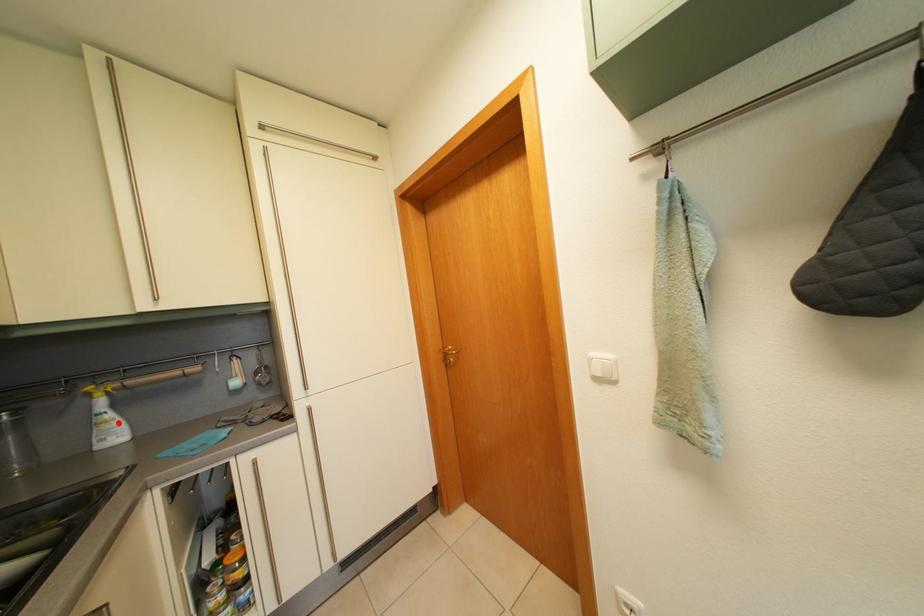
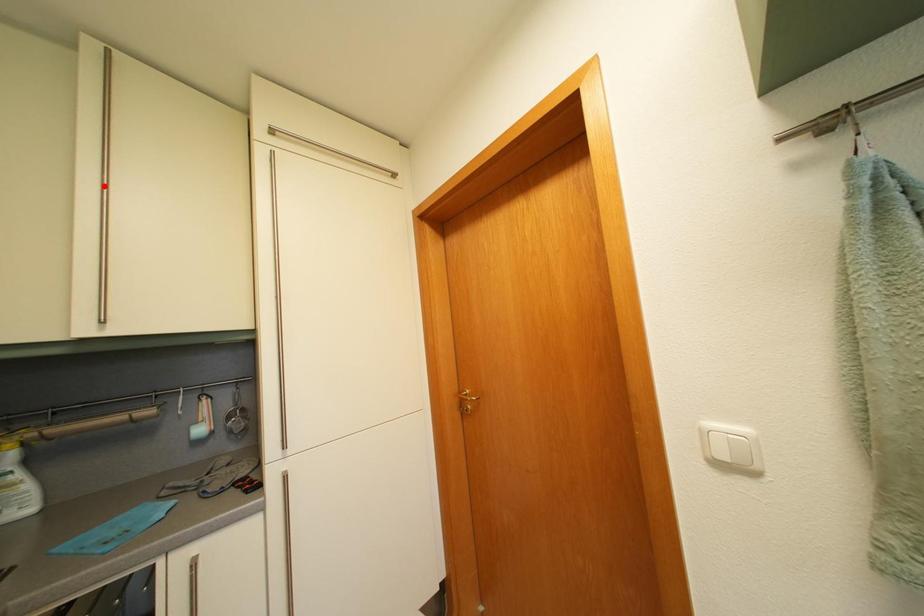
Based on the photo, I am providing you with two images of the same scene from different viewpoints. A red point is marked on the first image and another point is marked on the second image. Is the marked point in image1 the same physical position as the marked point in image2?

No